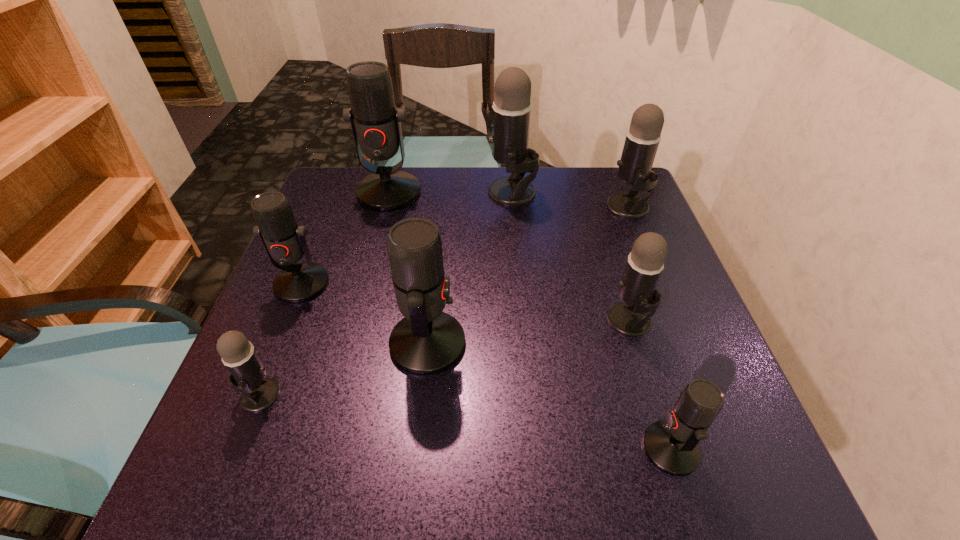
Locate an element on the screen. The width and height of the screenshot is (960, 540). the biggest gray microphone is located at coordinates (511, 112).

Locate an element on the screen. The width and height of the screenshot is (960, 540). the fifth microphone from left to right is located at coordinates (511, 112).

This screenshot has height=540, width=960. I want to click on the biggest red microphone, so click(376, 124).

Locate an element on the screen. This screenshot has height=540, width=960. the third farthest red microphone is located at coordinates (427, 341).

You are a GUI agent. You are given a task and a screenshot of the screen. Output one action in this format:
    pyautogui.click(x=<x>, y=<y>)
    Task: Click on the third smallest gray microphone
    
    Given the screenshot: What is the action you would take?
    pyautogui.click(x=642, y=140)

Find the location of a particular element. The width and height of the screenshot is (960, 540). the third biggest gray microphone is located at coordinates (637, 288).

Find the location of a particular element. The width and height of the screenshot is (960, 540). the second smallest red microphone is located at coordinates (283, 239).

You are a GUI agent. You are given a task and a screenshot of the screen. Output one action in this format:
    pyautogui.click(x=<x>, y=<y>)
    Task: Click on the leftmost gray microphone
    The height and width of the screenshot is (540, 960).
    Given the screenshot: What is the action you would take?
    pyautogui.click(x=248, y=373)

Identify the location of the second nearest object. (248, 373).

At what (x,y) coordinates should I click in order to perform the action: click on the nearest microphone. Please return your answer as a coordinate pair (x, y). This screenshot has width=960, height=540. Looking at the image, I should click on tap(672, 446).